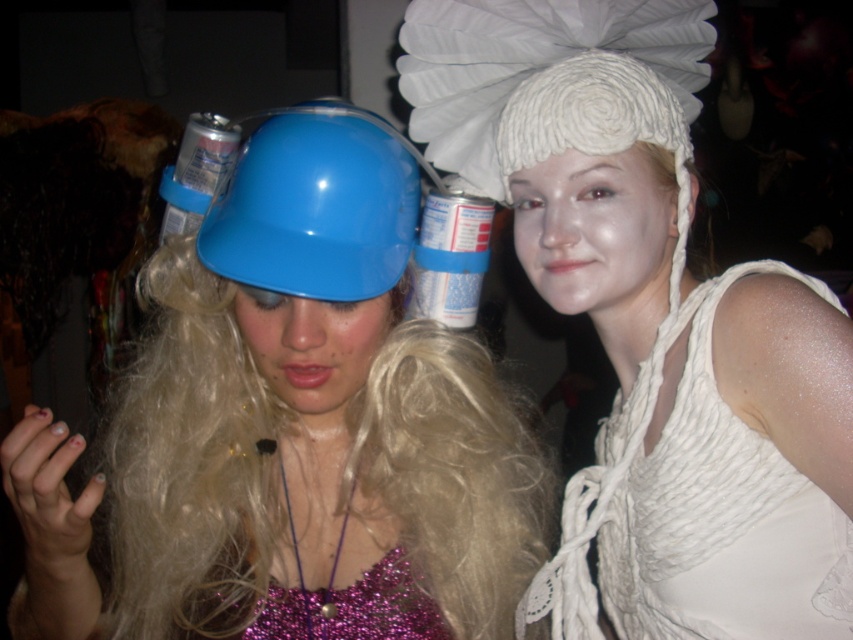
Looking at this image, you are a photographer trying to capture a clear shot of both the matte plastic helmet at center and the white knitted hat at upper center. Which object should you focus on first to ensure both are in focus?

You should focus on the matte plastic helmet at center first since it is closer to the viewer than the white knitted hat at upper center, allowing the depth of field to include both in focus.

You are designing a display stand for two helmets. The stand has two slots, one for each helmet. The slot for the matte plastic helmet at center must be wider than the slot for the blue glossy helmet at center. Which helmet requires a wider slot in the stand?

The matte plastic helmet at center requires a wider slot because its width is larger than the blue glossy helmet at center.